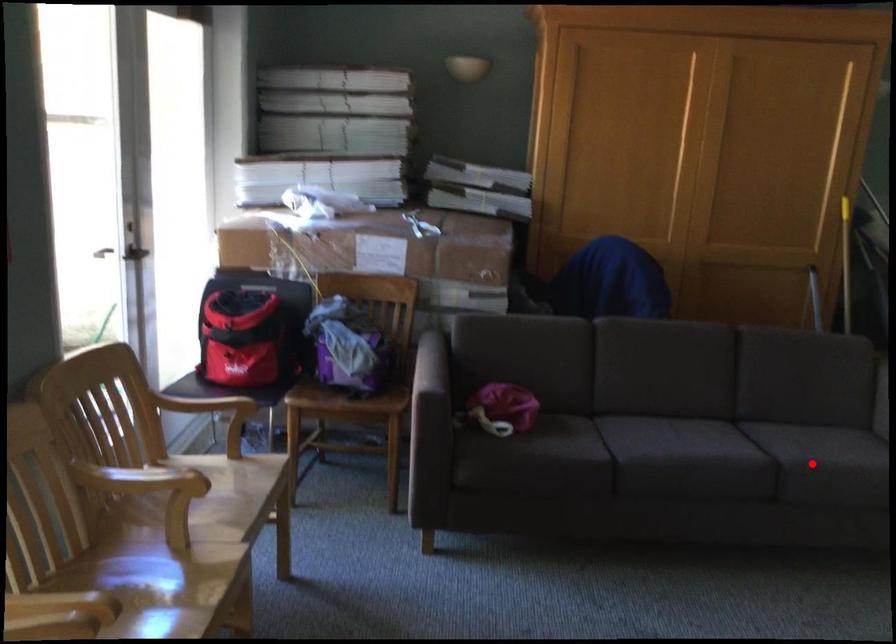
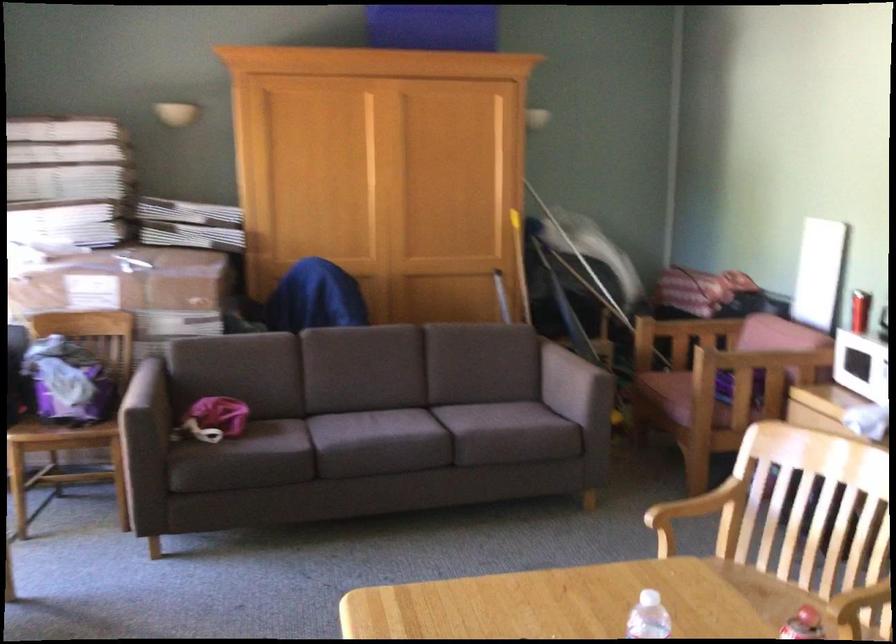
Where in the second image is the point corresponding to the highlighted location from the first image?

(467, 430)